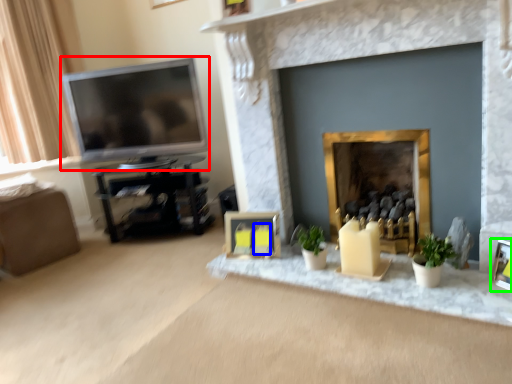
Question: Estimate the real-world distances between objects in this image. Which object is closer to television (highlighted by a red box), candle (highlighted by a blue box) or picture frame (highlighted by a green box)?

Choices:
 (A) candle
 (B) picture frame

Answer: (A)